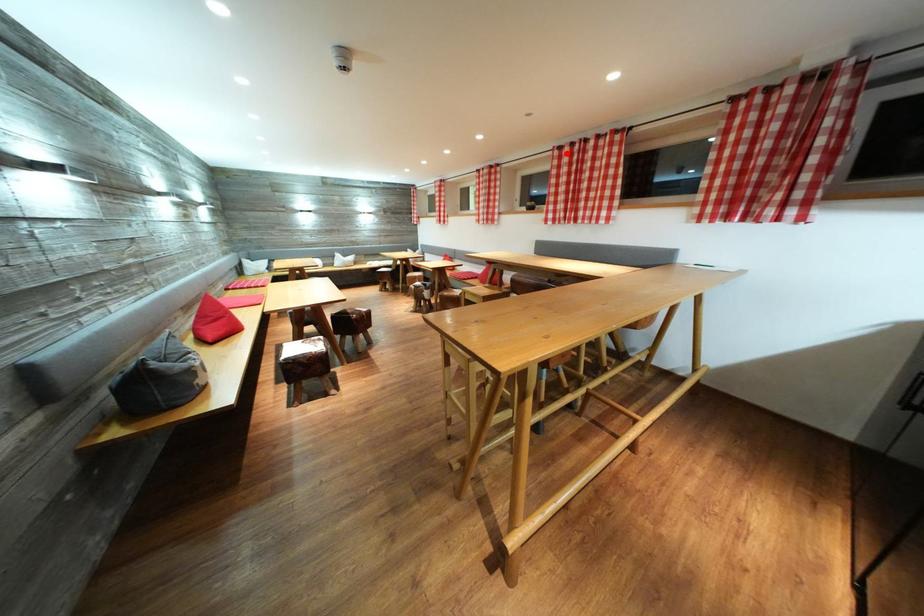
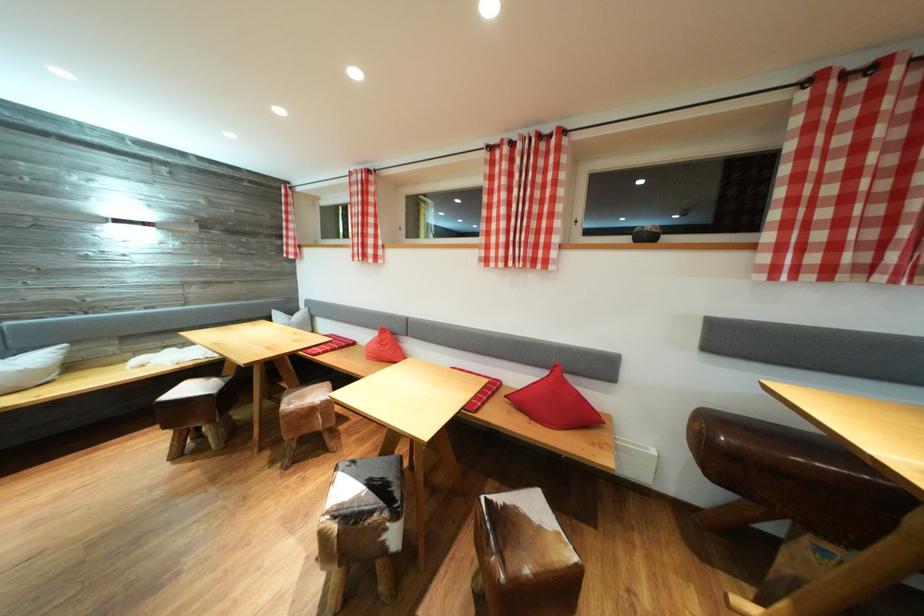
Question: I am providing you with two images of the same scene from different viewpoints. In image1, a red point is highlighted. Considering the same 3D point in image2, which of the following is correct?

Choices:
 (A) It is closer
 (B) It is farther

Answer: (B)